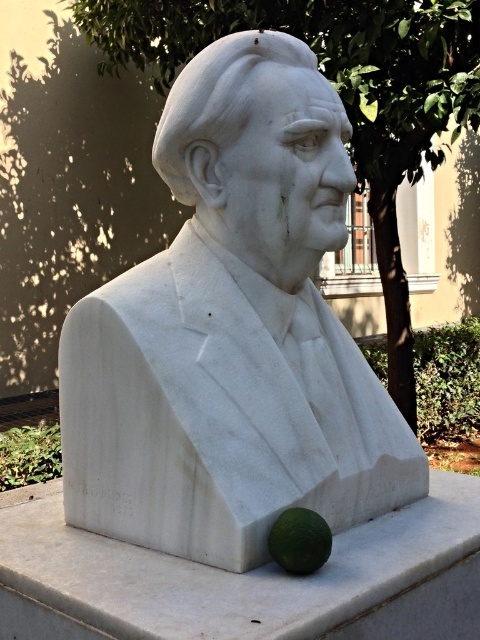
Question: Is white marble sphere at lower right above green matte lime at lower center?

Choices:
 (A) no
 (B) yes

Answer: (A)

Question: Where is white marble bust at center located in relation to green matte lime at lower center in the image?

Choices:
 (A) above
 (B) below

Answer: (A)

Question: Which is farther from the green matte lime at lower center?

Choices:
 (A) white marble sphere at lower right
 (B) white marble bust at center

Answer: (B)

Question: Is white marble bust at center above green matte lime at lower center?

Choices:
 (A) yes
 (B) no

Answer: (A)

Question: Based on their relative distances, which object is farther from the white marble sphere at lower right?

Choices:
 (A) green matte lime at lower center
 (B) white marble bust at center

Answer: (B)

Question: Which object appears farthest from the camera in this image?

Choices:
 (A) white marble bust at center
 (B) white marble sphere at lower right

Answer: (A)